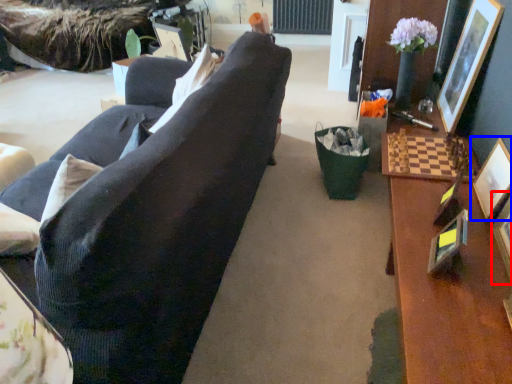
Question: Which of the following is the closest to the observer, picture frame (highlighted by a red box) or picture frame (highlighted by a blue box)?

Choices:
 (A) picture frame
 (B) picture frame

Answer: (A)